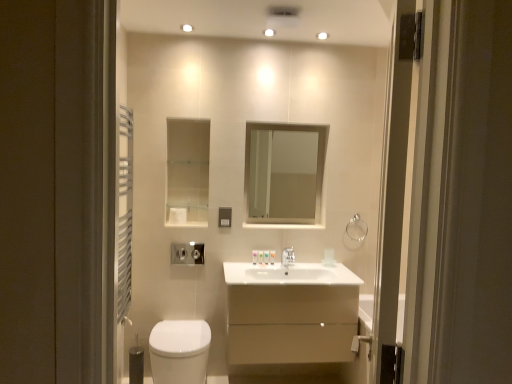
You are a GUI agent. You are given a task and a screenshot of the screen. Output one action in this format:
    pyautogui.click(x=<x>, y=<y>)
    Task: Click on the free spot to the left of silver metallic faucet at center
    
    Given the screenshot: What is the action you would take?
    pyautogui.click(x=263, y=266)